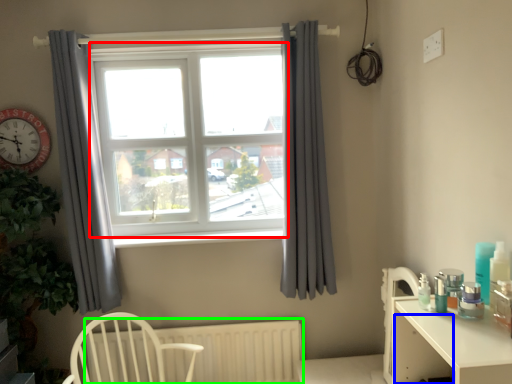
Question: Estimate the real-world distances between objects in this image. Which object is closer to window frame (highlighted by a red box), drawer (highlighted by a blue box) or radiator (highlighted by a green box)?

Choices:
 (A) drawer
 (B) radiator

Answer: (B)